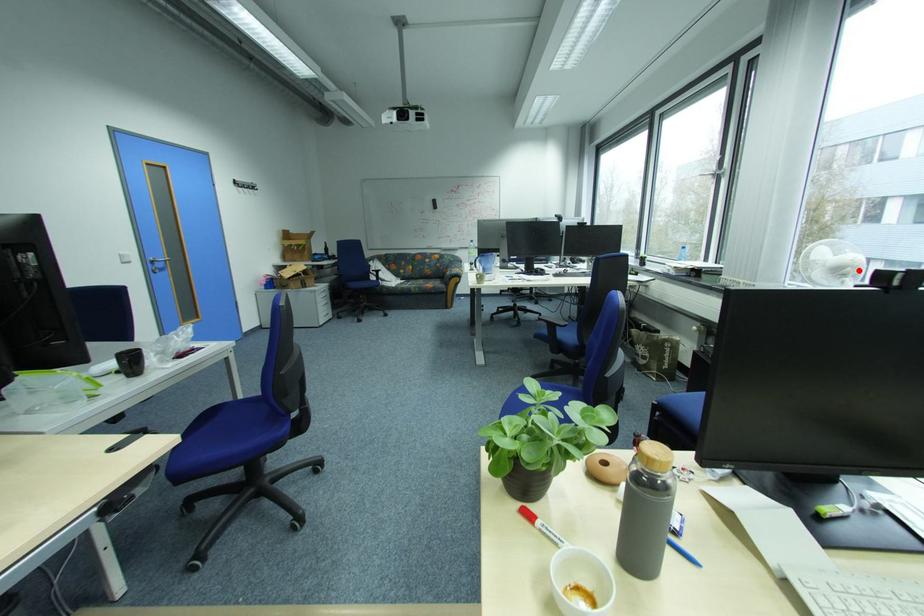
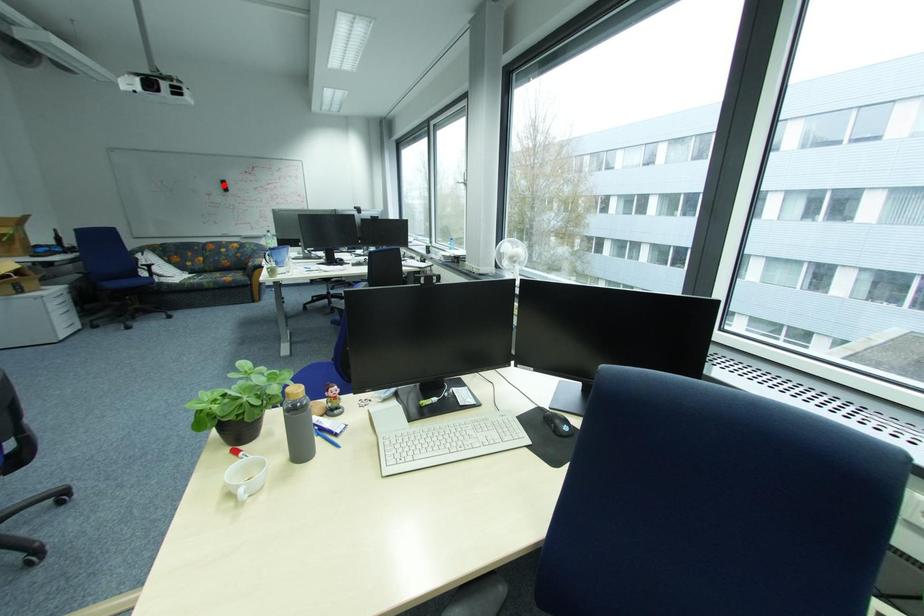
I am providing you with two images of the same scene from different viewpoints. A red point is marked on the first image and another point is marked on the second image. Is the marked point in image1 the same physical position as the marked point in image2?

No